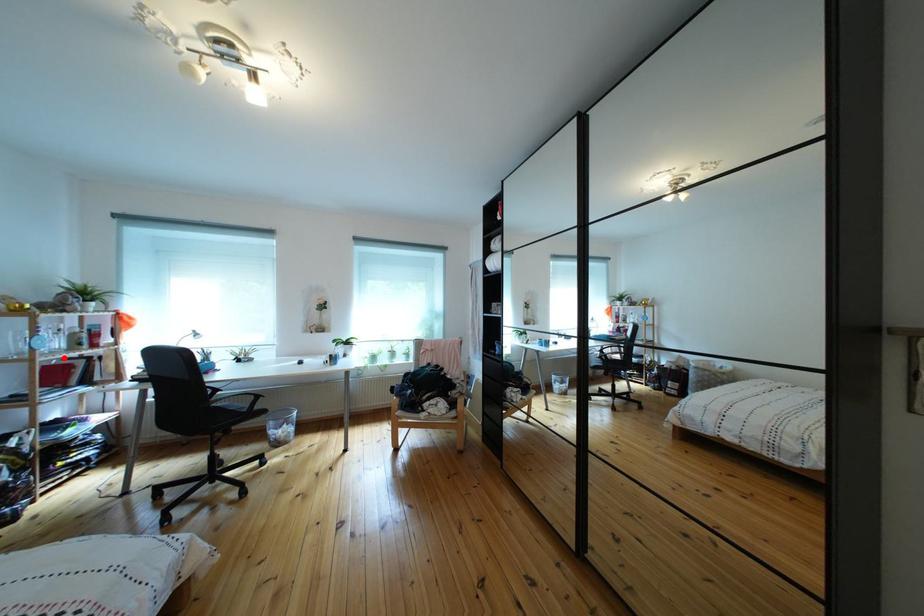
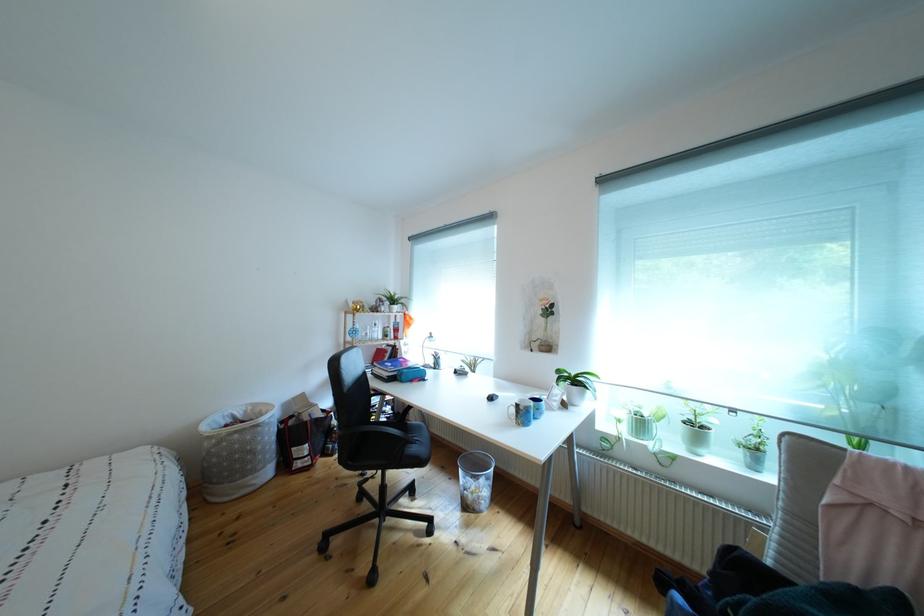
Find the pixel in the second image that matches the highlighted location in the first image.

(383, 345)